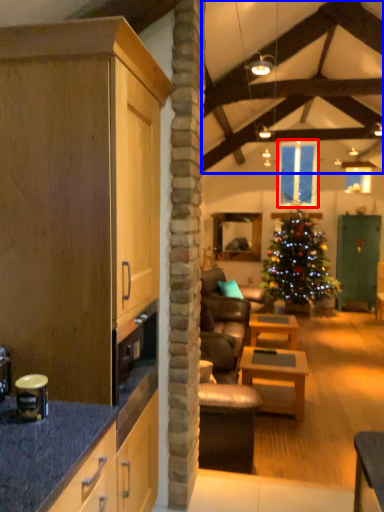
Question: Which point is closer to the camera, window (highlighted by a red box) or exhaust hood (highlighted by a blue box)?

Choices:
 (A) window
 (B) exhaust hood

Answer: (B)